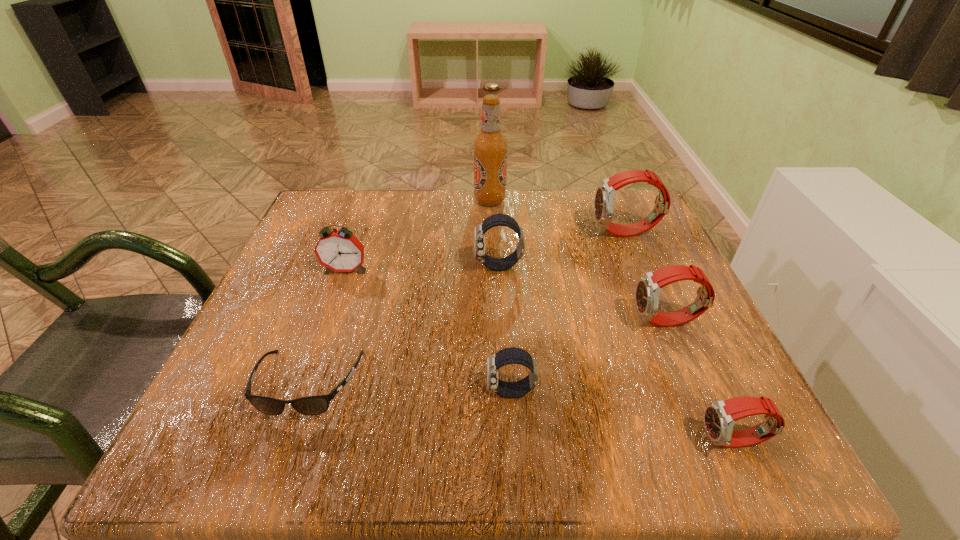
Find the location of a particular element. The height and width of the screenshot is (540, 960). the nearer dark watch is located at coordinates (512, 355).

Where is `the smallest red watch`? This screenshot has height=540, width=960. the smallest red watch is located at coordinates (720, 416).

Find the location of a particular element. The height and width of the screenshot is (540, 960). the nearest red watch is located at coordinates [x=720, y=416].

At what (x,y) coordinates should I click in order to perform the action: click on sunglasses. Please return your answer as a coordinate pair (x, y). The width and height of the screenshot is (960, 540). Looking at the image, I should click on (312, 405).

Image resolution: width=960 pixels, height=540 pixels. What are the coordinates of `gray sunglasses` in the screenshot? It's located at (312, 405).

Identify the location of vacant space positioned on the front label of the beer bottle. (344, 200).

Locate an element on the screen. vacant space located on the front label of the beer bottle is located at coordinates (379, 200).

Where is `vacant space located on the front label of the beer bottle`? The image size is (960, 540). vacant space located on the front label of the beer bottle is located at coordinates point(332,200).

Where is `vacant space located on the face of the second farthest object`? This screenshot has height=540, width=960. vacant space located on the face of the second farthest object is located at coordinates point(572,233).

I want to click on free space located on the face of the second farthest object, so click(x=446, y=233).